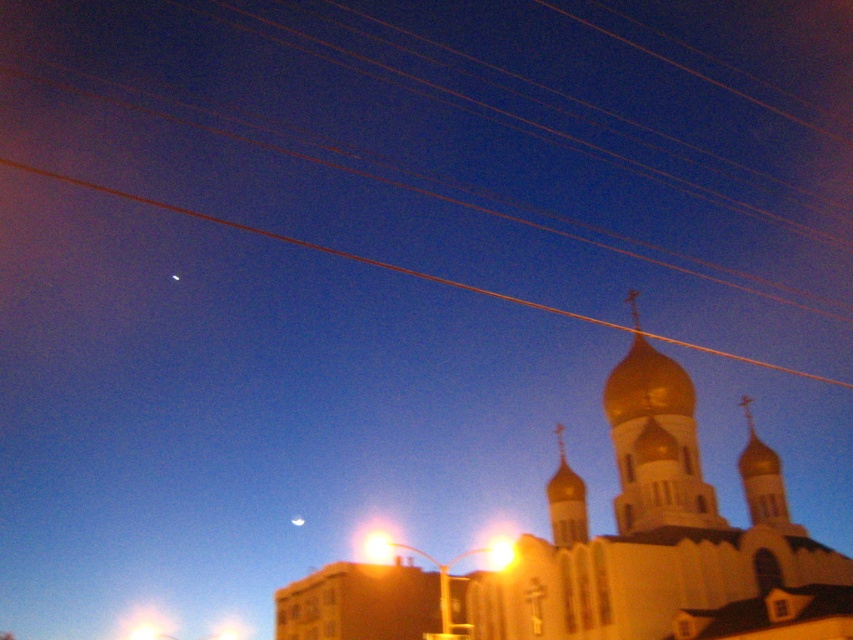
You are an astronomer observing the night sky and notice the yellow glass streetlight at center and the bright yellow light at upper center. Which object is closer to the top of the image?

The bright yellow light at upper center is closer to the top of the image because it is positioned above the yellow glass streetlight at center.

You are standing in front of the building and want to take a photo of the gold domed spire at upper center. If your camera can only focus on objects within a 0.5 unit radius from the center of the frame, will the spire be in focus?

The gold domed spire at upper center is located at point coordinates of (x=566, y=500). The distance from the center of the frame is sqrt of 0.783 squared plus 0.665 squared, which is approximately 1.026 units. Since this is greater than 0.5 units, the spire will not be in focus within the camera focus range.